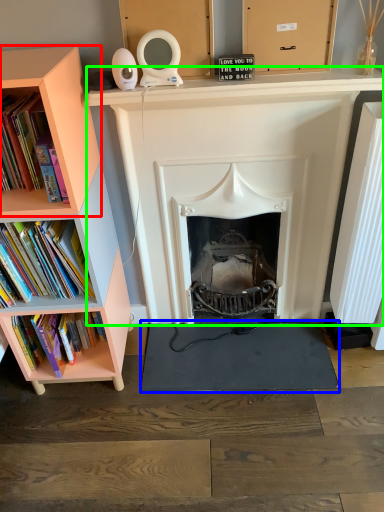
Question: Which is farther away from shelf (highlighted by a red box)? yoga mat (highlighted by a blue box) or fireplace (highlighted by a green box)?

Choices:
 (A) yoga mat
 (B) fireplace

Answer: (A)